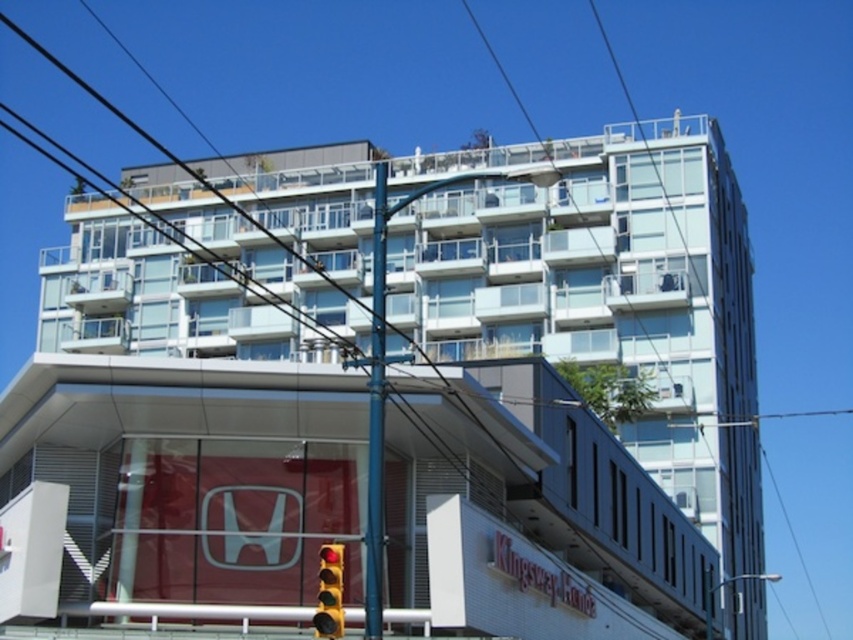
Question: Which object is positioned closest to the transparent glass power line at upper center?

Choices:
 (A) clear blue wire at upper center
 (B) transparent glass building at center

Answer: (B)

Question: Among these points, which one is farthest from the camera?

Choices:
 (A) 691,422
 (B) 465,417

Answer: (A)

Question: Which point is farther to the camera?

Choices:
 (A) (848, 413)
 (B) (675, 484)

Answer: (A)

Question: Is transparent glass building at center positioned at the back of blue metallic pole at center?

Choices:
 (A) yes
 (B) no

Answer: (A)

Question: Does transparent glass building at center have a lesser width compared to clear blue wire at upper center?

Choices:
 (A) yes
 (B) no

Answer: (A)

Question: Can you confirm if red glass traffic light at lower center is wider than clear blue wire at upper center?

Choices:
 (A) yes
 (B) no

Answer: (B)